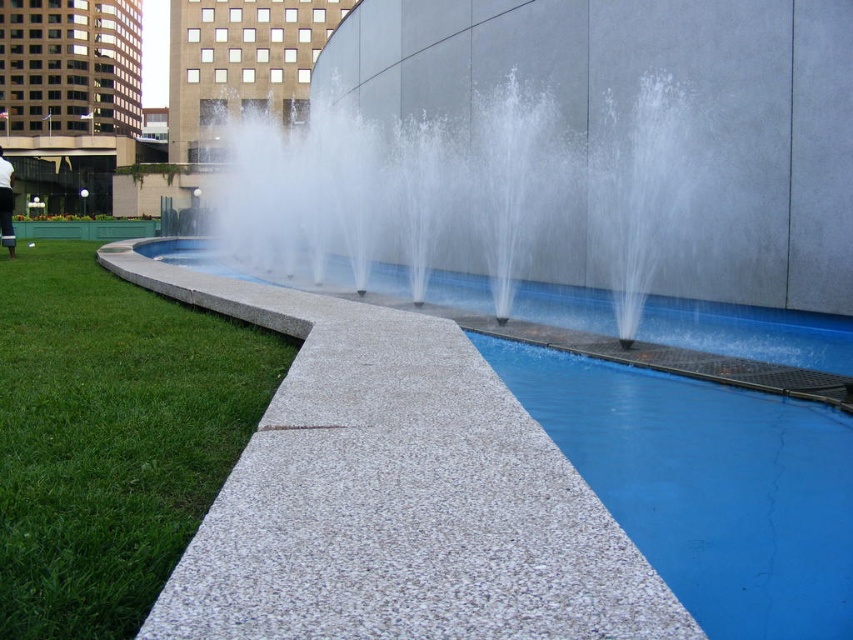
You are standing at the grassy area near the fountain and want to walk to the curved concrete edge. There are two markers labeled point (44, 465) and point (352, 186). Which point should you head towards to reach the curved concrete edge first?

Point (44, 465) is in front of point (352, 186), so you should head towards point (44, 465) to reach the curved concrete edge first.

You are standing at the center of the fountain and looking towards the grassy area. Which direction should you walk to reach the green grass at lower left?

You should walk towards the lower left direction to reach the green grass at lower left since it is located at point (109,436).